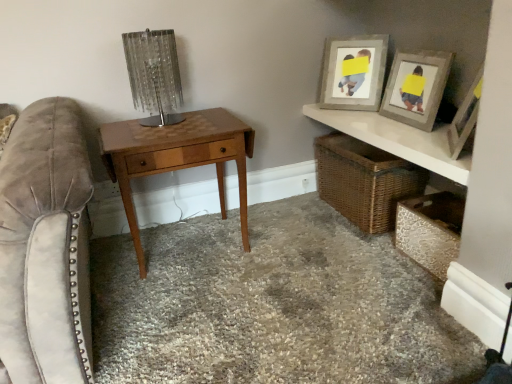
The image size is (512, 384). Identify the location of unoccupied region to the right of light brown wood table at center. (290, 258).